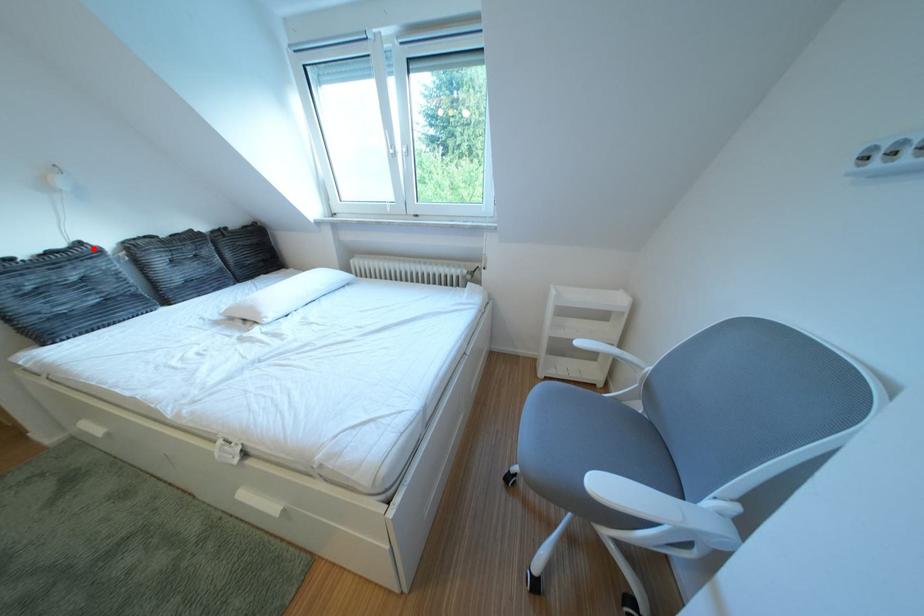
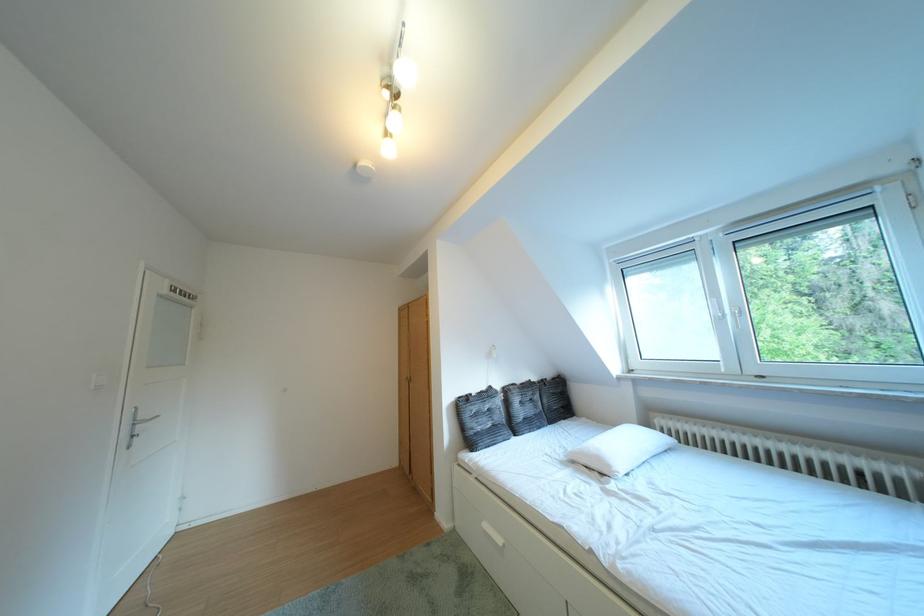
Question: A red point is marked in image1. In image2, is the corresponding 3D point closer to the camera or farther? Reply with the corresponding letter.

Choices:
 (A) The corresponding 3D point is closer.
 (B) The corresponding 3D point is farther.

Answer: (B)